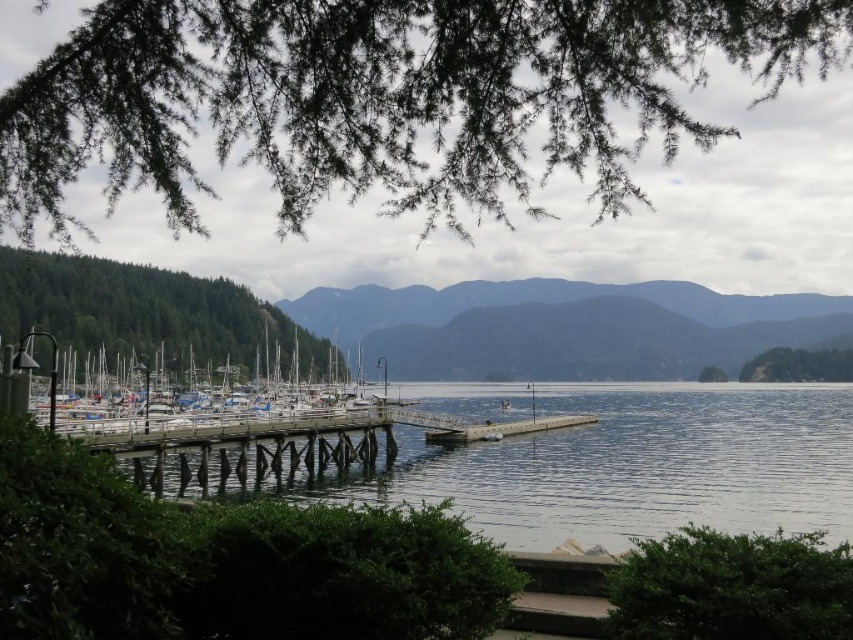
The height and width of the screenshot is (640, 853). What do you see at coordinates (384, 97) in the screenshot? I see `green needle-like branches at upper left` at bounding box center [384, 97].

Between point (169, 16) and point (51, 336), which one is positioned in front?

Point (169, 16) is more forward.

Image resolution: width=853 pixels, height=640 pixels. Identify the location of green needle-like branches at upper left. (384, 97).

Is green matte tree at left wider than white matte boats at center?

No, green matte tree at left is not wider than white matte boats at center.

Is green matte tree at left above white matte boats at center?

Indeed, green matte tree at left is positioned over white matte boats at center.

Does point (241, 324) come in front of point (148, 419)?

No.

Identify the location of green matte tree at left. click(x=136, y=308).

Does green needle-like branches at upper left have a lesser height compared to green matte tree at center?

In fact, green needle-like branches at upper left may be taller than green matte tree at center.

Between point (173, 212) and point (721, 376), which one is positioned behind?

Point (721, 376)

The image size is (853, 640). Find the location of `green needle-like branches at upper left`. green needle-like branches at upper left is located at coordinates (384, 97).